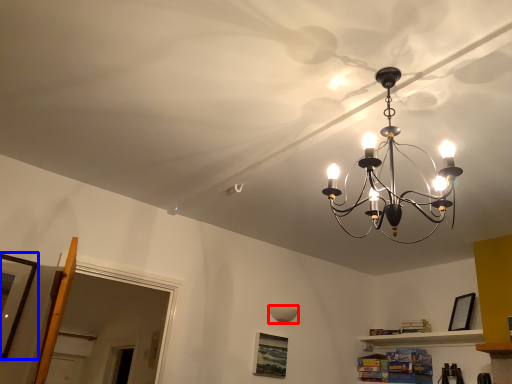
Question: Among these objects, which one is farthest to the camera, lamp (highlighted by a red box) or picture frame (highlighted by a blue box)?

Choices:
 (A) lamp
 (B) picture frame

Answer: (A)